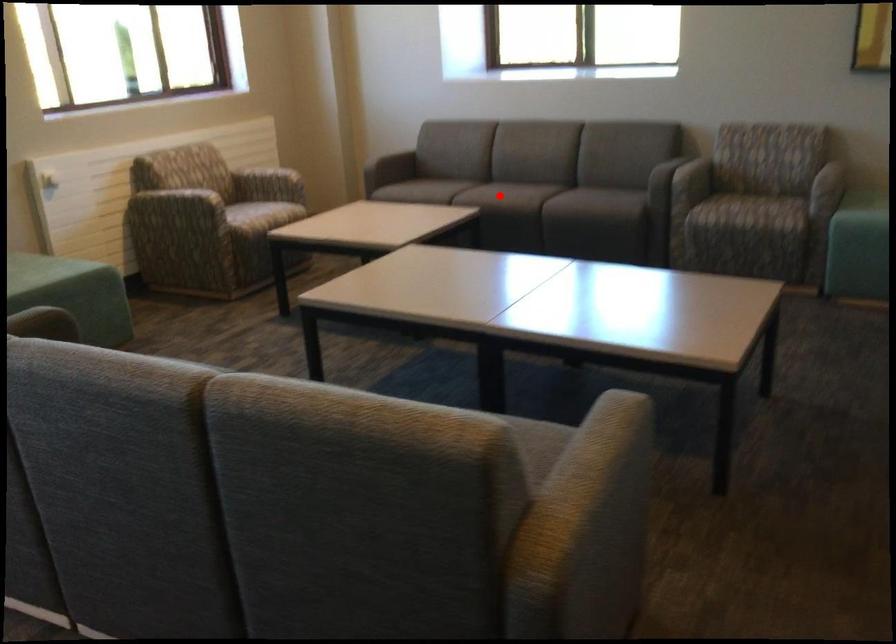
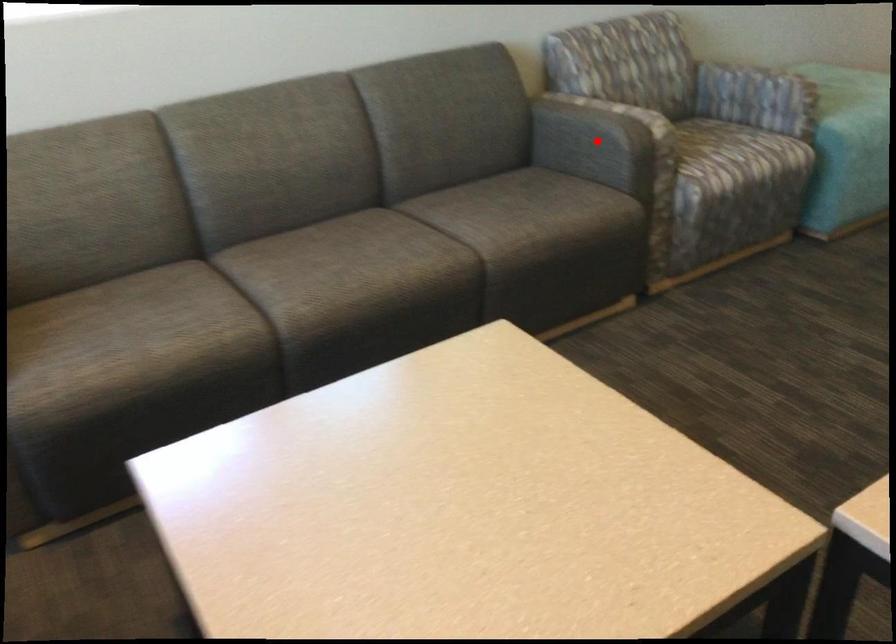
I am providing you with two images of the same scene from different viewpoints. A red point is marked on the first image and another point is marked on the second image. Is the marked point in image1 the same physical position as the marked point in image2?

No